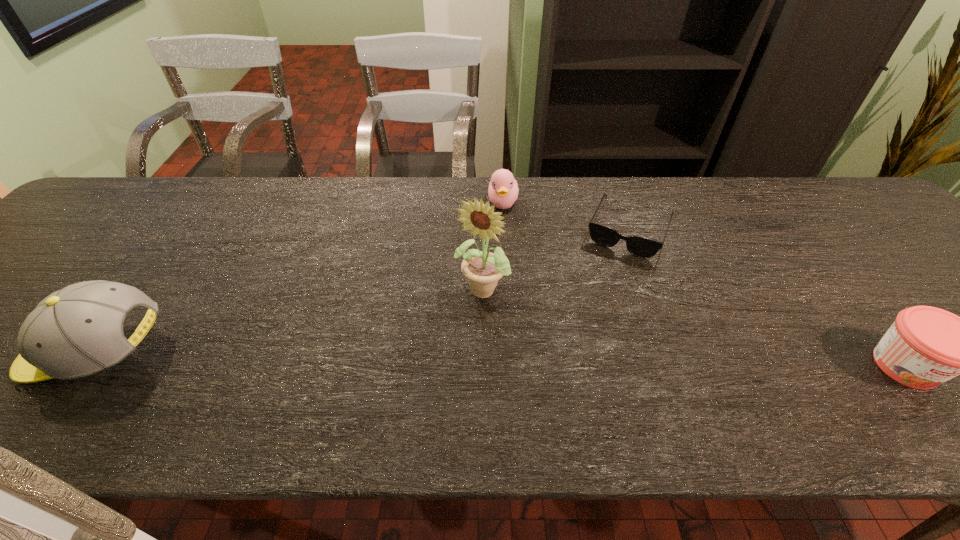
Identify the location of free point located 0.100m at the front lenses of the second object from right to left. The image size is (960, 540). (607, 285).

Locate an element on the screen. The image size is (960, 540). vacant space located 0.160m on the front-facing side of the tallest object is located at coordinates (436, 372).

Identify the location of free space located on the front-facing side of the tallest object. (438, 368).

Image resolution: width=960 pixels, height=540 pixels. Identify the location of free location located on the front-facing side of the tallest object. (443, 360).

You are a GUI agent. You are given a task and a screenshot of the screen. Output one action in this format:
    pyautogui.click(x=<x>, y=<y>)
    Task: Click on the duckling that is at the far edge
    The width and height of the screenshot is (960, 540).
    Given the screenshot: What is the action you would take?
    pyautogui.click(x=503, y=190)

The height and width of the screenshot is (540, 960). I want to click on sunglasses that is at the far edge, so click(x=639, y=246).

Image resolution: width=960 pixels, height=540 pixels. I want to click on blank space at the far edge of the desktop, so click(529, 176).

The height and width of the screenshot is (540, 960). I want to click on vacant space at the near edge of the desktop, so click(370, 387).

The width and height of the screenshot is (960, 540). Identify the location of free region at the right edge of the desktop. (891, 284).

In the image, there is a desktop. Identify the location of free space at the far left corner. This screenshot has width=960, height=540. (98, 226).